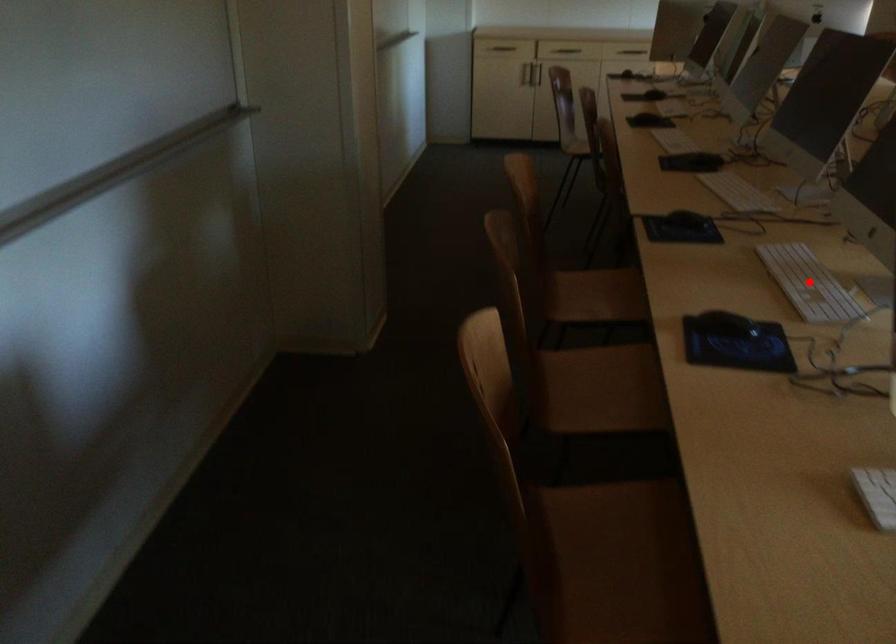
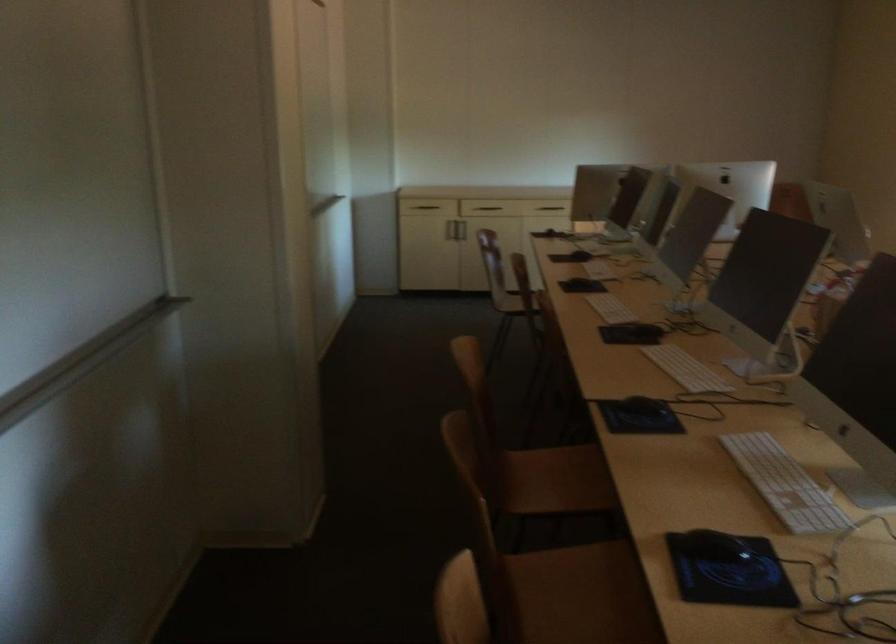
Where in the second image is the point corresponding to the highlighted location from the first image?

(784, 484)